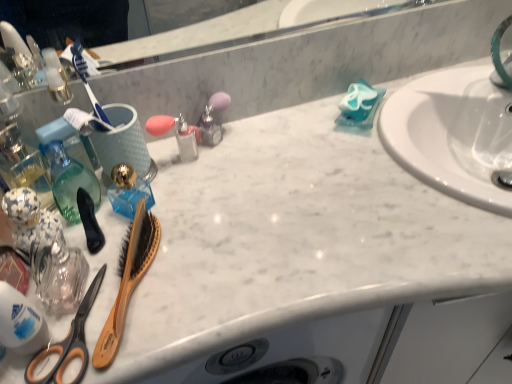
Locate an element on the screen. This screenshot has width=512, height=384. vacant area in front of translucent purple bottle at center is located at coordinates (221, 200).